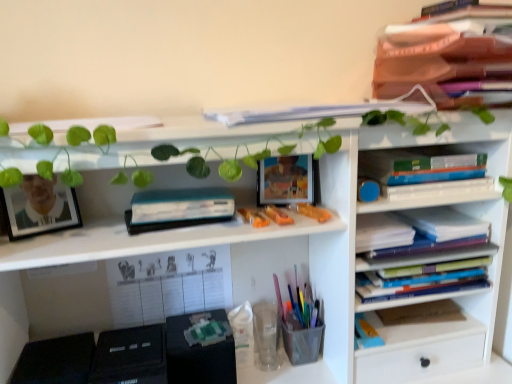
Question: Would you say blue hardcover book at right, acting as the 5th book starting from the top, is to the left or to the right of blue hardcover book at center right, which ranks as the sixth book in bottom-to-top order, in the picture?

Choices:
 (A) right
 (B) left

Answer: (B)

Question: From a real-world perspective, is blue hardcover book at right, which ranks as the fifth book in bottom-to-top order, positioned above or below blue hardcover book at center right, which ranks as the sixth book in bottom-to-top order?

Choices:
 (A) above
 (B) below

Answer: (B)

Question: Which object is the farthest from the blue hardcover book at lower right, the 9th book in the top-to-bottom sequence?

Choices:
 (A) hardcover books at center right, the third book ordered from the bottom
 (B) white paper at upper center, which appears as the 2th book when viewed from the top
 (C) translucent plastic toy at upper center
 (D) blue hardcover book at center right, which ranks as the sixth book in bottom-to-top order
 (E) white matte bookshelf at upper center

Answer: (B)

Question: Based on their relative distances, which object is nearer to the translucent plastic toy at upper center?

Choices:
 (A) matte black picture frame at left
 (B) translucent plastic pen holder at center
 (C) hardcover books at right, which ranks as the fourth book in bottom-to-top order
 (D) teal matte paperback book at center
 (E) white matte bookshelf at upper center

Answer: (D)